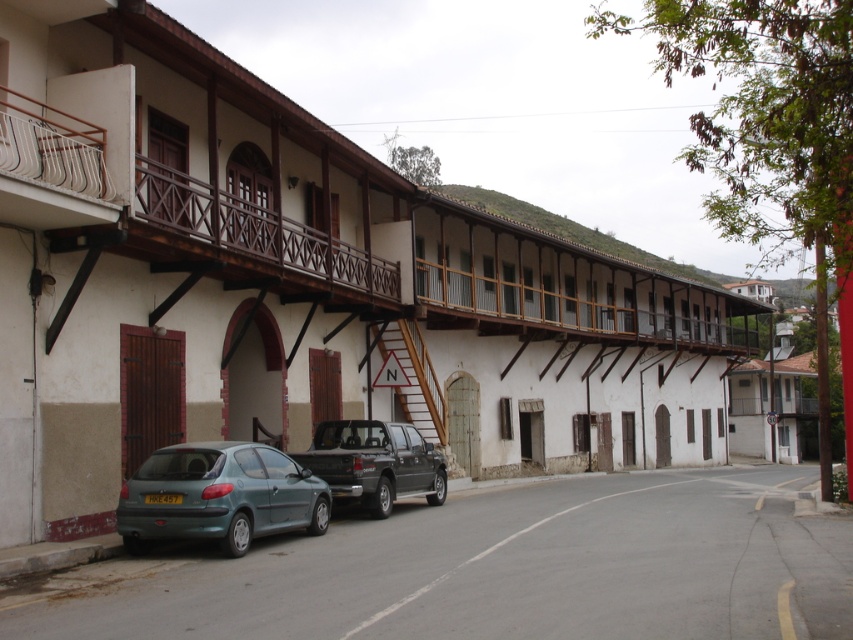
In the scene shown: You are standing on the sidewalk in front of the building and want to cross the street to reach the dark gray matte truck at center. What is the shortest path you can take to reach the truck without entering the road?

The shortest path would involve walking along the sidewalk to the nearest point closest to the dark gray matte truck at center, as the truck is located at the center of the road. However, since you must stay on the sidewalk, you cannot directly reach the truck without crossing the road. Therefore, you would need to follow the sidewalk around to the nearest driveway or crosswalk to access the truck.

You are a delivery person trying to park your dark gray matte truck at center in a spot that requires clearance under the wooden staircase at center. Can your truck fit under the staircase?

The dark gray matte truck at center has a lesser height compared to wooden staircase at center, so it can fit under the staircase.

You are standing at the point marked by the coordinates point (219, 496). Looking towards the building, which object is directly in front of you?

The point (219, 496) marks the teal matte hatchback at lower left, so the building is directly in front of you.